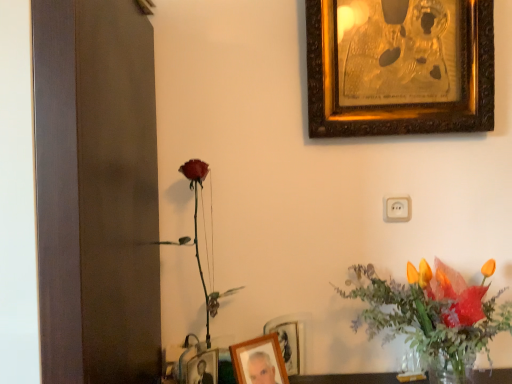
Where is `wooden photo frame at lower center, which is counted as the third picture frame, starting from the right`? The image size is (512, 384). wooden photo frame at lower center, which is counted as the third picture frame, starting from the right is located at coordinates (259, 361).

The width and height of the screenshot is (512, 384). Describe the element at coordinates (259, 361) in the screenshot. I see `wooden photo frame at lower center, which is the third picture frame in back-to-front order` at that location.

You are a GUI agent. You are given a task and a screenshot of the screen. Output one action in this format:
    pyautogui.click(x=<x>, y=<y>)
    Task: Click on the white plastic electric outlet at center
    
    Given the screenshot: What is the action you would take?
    pyautogui.click(x=397, y=209)

This screenshot has width=512, height=384. What are the coordinates of `wooden photo frame at lower center, which appears as the second picture frame when viewed from the back` in the screenshot? It's located at (290, 340).

In the scene shown: Between white plastic electric outlet at center and wooden photo frame at lower center, the first picture frame positioned from the left, which one has smaller width?

white plastic electric outlet at center is thinner.

Is white plastic electric outlet at center directly adjacent to wooden photo frame at lower center, the 2th picture frame positioned from the top?

white plastic electric outlet at center and wooden photo frame at lower center, the 2th picture frame positioned from the top, are clearly separated.

Can you confirm if white plastic electric outlet at center is shorter than wooden photo frame at lower center, which is counted as the third picture frame, starting from the right?

Yes.

Is point (384, 210) closer to viewer compared to point (280, 337)?

No, (384, 210) is further to viewer.

Can you confirm if white plastic electric outlet at center is thinner than wooden photo frame at lower center, the 3th picture frame viewed from the top?

Correct, the width of white plastic electric outlet at center is less than that of wooden photo frame at lower center, the 3th picture frame viewed from the top.

From a real-world perspective, is white plastic electric outlet at center on wooden photo frame at lower center, which ranks as the second picture frame in right-to-left order?

Yes.

Is white plastic electric outlet at center next to wooden photo frame at lower center, which ranks as the second picture frame in right-to-left order, and touching it?

white plastic electric outlet at center and wooden photo frame at lower center, which ranks as the second picture frame in right-to-left order, are not in contact.

Is gold ornate picture frame at upper right, the first picture frame when ordered from top to bottom, directly adjacent to wooden photo frame at lower center, which is the third picture frame in back-to-front order?

There is a gap between gold ornate picture frame at upper right, the first picture frame when ordered from top to bottom, and wooden photo frame at lower center, which is the third picture frame in back-to-front order.

From a real-world perspective, is gold ornate picture frame at upper right, the first picture frame when ordered from right to left, below wooden photo frame at lower center, which is counted as the third picture frame, starting from the right?

No, from a real-world perspective, gold ornate picture frame at upper right, the first picture frame when ordered from right to left, is not beneath wooden photo frame at lower center, which is counted as the third picture frame, starting from the right.

How many degrees apart are the facing directions of gold ornate picture frame at upper right, the first picture frame when ordered from top to bottom, and wooden photo frame at lower center, which is counted as the third picture frame, starting from the right?

The facing directions of gold ornate picture frame at upper right, the first picture frame when ordered from top to bottom, and wooden photo frame at lower center, which is counted as the third picture frame, starting from the right, are 36.7 degrees apart.

From the image's perspective, is gold ornate picture frame at upper right, the first picture frame when ordered from right to left, on top of wooden photo frame at lower center, the 2th picture frame positioned from the top?

Yes.

Based on their sizes in the image, would you say wooden photo frame at lower center, the 2th picture frame positioned from the top, is bigger or smaller than white plastic electric outlet at center?

Clearly, wooden photo frame at lower center, the 2th picture frame positioned from the top, is larger in size than white plastic electric outlet at center.

Is wooden photo frame at lower center, the first picture frame positioned from the front, not near white plastic electric outlet at center?

That's not correct — wooden photo frame at lower center, the first picture frame positioned from the front, is a little close to white plastic electric outlet at center.

Which is more to the right, wooden photo frame at lower center, the first picture frame positioned from the left, or white plastic electric outlet at center?

white plastic electric outlet at center.

Could you tell me if wooden photo frame at lower center, which ranks as the second picture frame in right-to-left order, is turned towards gold ornate picture frame at upper right, the first picture frame when ordered from right to left?

No, wooden photo frame at lower center, which ranks as the second picture frame in right-to-left order, is not turned towards gold ornate picture frame at upper right, the first picture frame when ordered from right to left.

How many degrees apart are the facing directions of wooden photo frame at lower center, which appears as the second picture frame when viewed from the front, and gold ornate picture frame at upper right, which appears as the 3th picture frame when ordered from the bottom?

40 degrees separate the facing orientations of wooden photo frame at lower center, which appears as the second picture frame when viewed from the front, and gold ornate picture frame at upper right, which appears as the 3th picture frame when ordered from the bottom.

Considering the sizes of wooden photo frame at lower center, the 3th picture frame viewed from the top, and gold ornate picture frame at upper right, the first picture frame when ordered from right to left, in the image, is wooden photo frame at lower center, the 3th picture frame viewed from the top, bigger or smaller than gold ornate picture frame at upper right, the first picture frame when ordered from right to left,?

wooden photo frame at lower center, the 3th picture frame viewed from the top, is smaller than gold ornate picture frame at upper right, the first picture frame when ordered from right to left.

Based on the photo, between wooden photo frame at lower center, which is the second picture frame in left-to-right order, and gold ornate picture frame at upper right, the first picture frame when ordered from top to bottom, which one appears on the left side from the viewer's perspective?

wooden photo frame at lower center, which is the second picture frame in left-to-right order, is more to the left.

Can you confirm if wooden photo frame at lower center, which is the second picture frame in left-to-right order, is smaller than white plastic electric outlet at center?

Incorrect, wooden photo frame at lower center, which is the second picture frame in left-to-right order, is not smaller in size than white plastic electric outlet at center.

From the white plastic electric outlet at center, count the 2nd picture frame to the left and point to it. Please provide its 2D coordinates.

[(290, 340)]

Are wooden photo frame at lower center, the 3th picture frame viewed from the top, and white plastic electric outlet at center far apart?

That's not correct — wooden photo frame at lower center, the 3th picture frame viewed from the top, is a little close to white plastic electric outlet at center.

Is translucent glass vase at lower right oriented towards gold ornate picture frame at upper right, placed as the 3th picture frame when sorted from front to back?

No, translucent glass vase at lower right is not aimed at gold ornate picture frame at upper right, placed as the 3th picture frame when sorted from front to back.

Considering their positions, is translucent glass vase at lower right located in front of or behind gold ornate picture frame at upper right, the first picture frame when ordered from top to bottom?

translucent glass vase at lower right is positioned closer to the viewer than gold ornate picture frame at upper right, the first picture frame when ordered from top to bottom.

Where is `electric outlet lying behind the wooden photo frame at lower center, the first picture frame positioned from the left`? electric outlet lying behind the wooden photo frame at lower center, the first picture frame positioned from the left is located at coordinates (397, 209).

Find the location of a particular element. Image resolution: width=512 pixels, height=384 pixels. the 2nd picture frame below when counting from the white plastic electric outlet at center (from the image's perspective) is located at coordinates (x=290, y=340).

Looking at the image, which one is located closer to wooden photo frame at lower center, the 2th picture frame positioned from the top, wooden photo frame at lower center, which appears as the second picture frame when viewed from the back, or white plastic electric outlet at center?

wooden photo frame at lower center, which appears as the second picture frame when viewed from the back.

From the image, which object appears to be farther from white plastic electric outlet at center, gold ornate picture frame at upper right, the first picture frame when ordered from right to left, or wooden photo frame at lower center, the first picture frame positioned from the left?

wooden photo frame at lower center, the first picture frame positioned from the left.

Based on their spatial positions, is wooden photo frame at lower center, which appears as the second picture frame when viewed from the front, or wooden photo frame at lower center, which is counted as the third picture frame, starting from the right, closer to translucent glass vase at lower right?

wooden photo frame at lower center, which appears as the second picture frame when viewed from the front, is closer to translucent glass vase at lower right.

Considering their positions, is translucent glass vase at lower right positioned closer to wooden photo frame at lower center, the first picture frame positioned from the left, than gold ornate picture frame at upper right, the 1th picture frame in the back-to-front sequence?

The object closer to wooden photo frame at lower center, the first picture frame positioned from the left, is translucent glass vase at lower right.

From the image, which object appears to be farther from translucent glass vase at lower right, wooden photo frame at lower center, the 3th picture frame viewed from the top, or white plastic electric outlet at center?

wooden photo frame at lower center, the 3th picture frame viewed from the top, is further to translucent glass vase at lower right.

Considering their positions, is wooden photo frame at lower center, the first picture frame in the bottom-to-top sequence, positioned closer to gold ornate picture frame at upper right, the first picture frame when ordered from right to left, than white plastic electric outlet at center?

The object closer to gold ornate picture frame at upper right, the first picture frame when ordered from right to left, is white plastic electric outlet at center.

Estimate the real-world distances between objects in this image. Which object is further from gold ornate picture frame at upper right, which appears as the 3th picture frame when ordered from the bottom, wooden photo frame at lower center, the second picture frame ordered from the bottom, or wooden photo frame at lower center, the 3th picture frame viewed from the top?

wooden photo frame at lower center, the second picture frame ordered from the bottom, is positioned further to the anchor gold ornate picture frame at upper right, which appears as the 3th picture frame when ordered from the bottom.

Estimate the real-world distances between objects in this image. Which object is further from translucent glass vase at lower right, gold ornate picture frame at upper right, the first picture frame when ordered from right to left, or wooden photo frame at lower center, the 2th picture frame positioned from the top?

gold ornate picture frame at upper right, the first picture frame when ordered from right to left, is further to translucent glass vase at lower right.

Where is `electric outlet between gold ornate picture frame at upper right, which appears as the 3th picture frame when ordered from the bottom, and translucent glass vase at lower right vertically`? The image size is (512, 384). electric outlet between gold ornate picture frame at upper right, which appears as the 3th picture frame when ordered from the bottom, and translucent glass vase at lower right vertically is located at coordinates (397, 209).

The height and width of the screenshot is (384, 512). In order to click on floral arrangement between gold ornate picture frame at upper right, which appears as the 3th picture frame when ordered from the bottom, and wooden photo frame at lower center, which is the second picture frame in left-to-right order, from top to bottom in this screenshot , I will do `click(431, 311)`.

Find the location of a particular element. electric outlet located between wooden photo frame at lower center, which appears as the second picture frame when viewed from the front, and translucent glass vase at lower right in the left-right direction is located at coordinates (397, 209).

Locate an element on the screen. picture frame between gold ornate picture frame at upper right, the 1th picture frame in the back-to-front sequence, and wooden photo frame at lower center, which ranks as the second picture frame in right-to-left order, vertically is located at coordinates (259, 361).